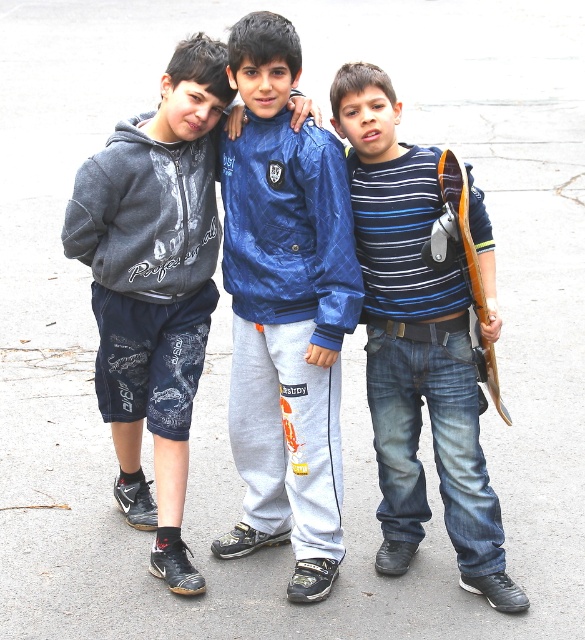
Can you confirm if dark gray hoodie at center is positioned below blue striped shirt at center?

Actually, dark gray hoodie at center is above blue striped shirt at center.

Does dark gray hoodie at center have a lesser width compared to blue striped shirt at center?

Yes.

Where is `dark gray hoodie at center`? dark gray hoodie at center is located at coordinates (154, 284).

Can you confirm if blue shiny jacket at center is bigger than dark gray hoodie at center?

Actually, blue shiny jacket at center might be smaller than dark gray hoodie at center.

Does blue shiny jacket at center have a lesser width compared to dark gray hoodie at center?

Yes.

The width and height of the screenshot is (585, 640). Identify the location of blue shiny jacket at center. (285, 310).

Who is positioned more to the left, dark gray hoodie at center or wooden skateboard at right?

Positioned to the left is dark gray hoodie at center.

Between dark gray hoodie at center and wooden skateboard at right, which one has more height?

dark gray hoodie at center

Identify the location of dark gray hoodie at center. 154,284.

Where is `dark gray hoodie at center`? dark gray hoodie at center is located at coordinates pos(154,284).